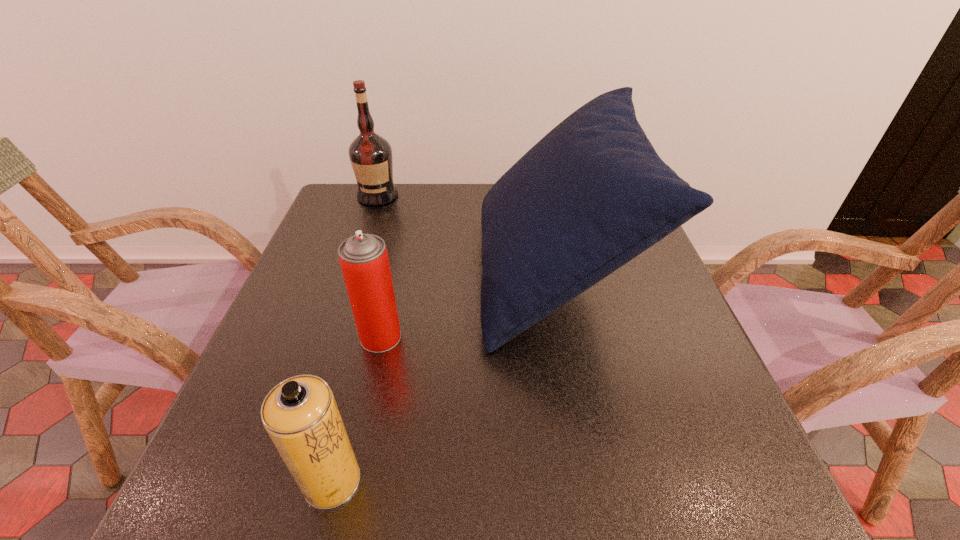
This screenshot has height=540, width=960. What are the coordinates of `cushion that is positioned at the far edge` in the screenshot? It's located at (591, 195).

I want to click on liquor that is positioned at the far edge, so click(370, 155).

Identify the location of object present at the near edge. (300, 414).

This screenshot has width=960, height=540. I want to click on object located at the left edge, so [370, 155].

Locate an element on the screen. The height and width of the screenshot is (540, 960). object situated at the right edge is located at coordinates (591, 195).

Find the location of `object located at the far left corner`. object located at the far left corner is located at coordinates (370, 155).

What are the coordinates of `object that is at the far right corner` in the screenshot? It's located at (591, 195).

This screenshot has height=540, width=960. I want to click on free space at the near edge of the desktop, so click(549, 480).

The height and width of the screenshot is (540, 960). Find the location of `vacant region at the left edge of the desktop`. vacant region at the left edge of the desktop is located at coordinates (290, 282).

Find the location of a particular element. free space at the right edge is located at coordinates (659, 258).